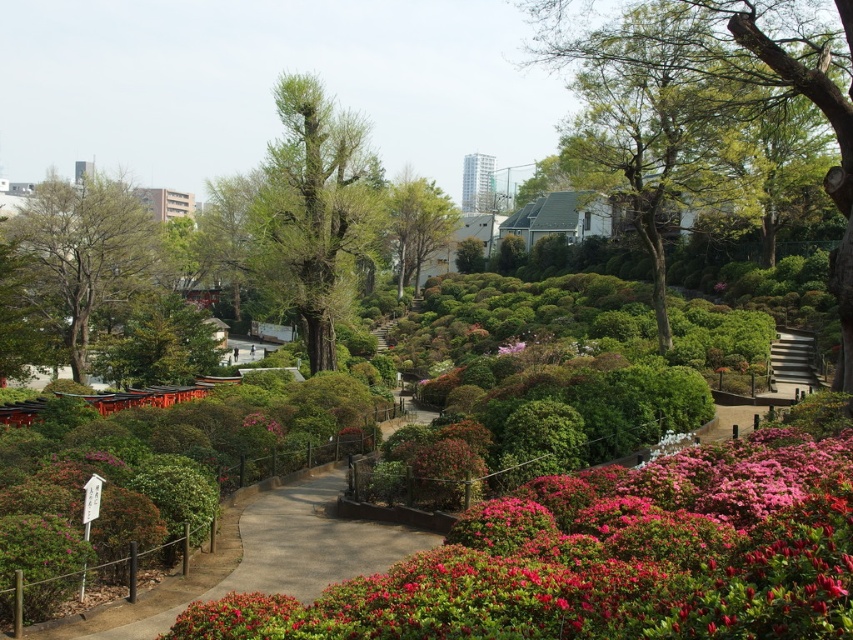
Can you confirm if green rough bark tree at center is wider than green leafy tree at center?

Yes, green rough bark tree at center is wider than green leafy tree at center.

Between green rough bark tree at center and green leafy tree at center, which one appears on the left side from the viewer's perspective?

From the viewer's perspective, green rough bark tree at center appears more on the left side.

Locate an element on the screen. green rough bark tree at center is located at coordinates (314, 208).

Does green leafy bushes at center have a lesser width compared to green rough bark tree at left?

Yes.

Which of these two, green leafy bushes at center or green rough bark tree at left, stands taller?

green rough bark tree at left is taller.

Does point (653, 522) come farther from viewer compared to point (74, 349)?

No, it is in front of (74, 349).

This screenshot has width=853, height=640. In order to click on green leafy bushes at center in this screenshot , I will do `click(614, 554)`.

Does green leafy bushes at center lie behind green leafy tree at center?

No, green leafy bushes at center is in front of green leafy tree at center.

Does point (693, 536) lie in front of point (450, 225)?

That is True.

Which is in front, point (824, 461) or point (399, 266)?

Point (824, 461)

Locate an element on the screen. This screenshot has width=853, height=640. green leafy bushes at center is located at coordinates click(x=614, y=554).